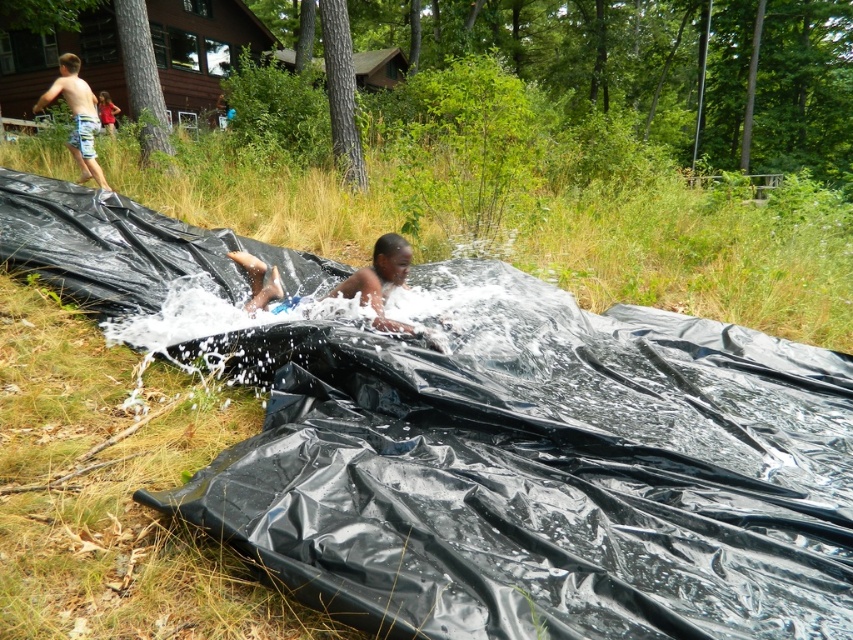
Question: Can you confirm if green grass at lower center is positioned above matte black child at center?

Choices:
 (A) no
 (B) yes

Answer: (B)

Question: Can you confirm if matte black child at center is smaller than light blue striped shorts at upper left?

Choices:
 (A) no
 (B) yes

Answer: (B)

Question: Among these points, which one is farthest from the camera?

Choices:
 (A) (71, 76)
 (B) (119, 132)
 (C) (109, 125)

Answer: (C)

Question: Is matte black child at center to the right of light blue striped shorts at upper left from the viewer's perspective?

Choices:
 (A) yes
 (B) no

Answer: (A)

Question: Which point is closer to the camera?

Choices:
 (A) green grass at lower center
 (B) light blue striped shorts at upper left
 (C) red fabric shirt at upper left

Answer: (A)

Question: Which of these objects is positioned closest to the light blue striped shorts at upper left?

Choices:
 (A) red fabric shirt at upper left
 (B) matte black child at center

Answer: (A)